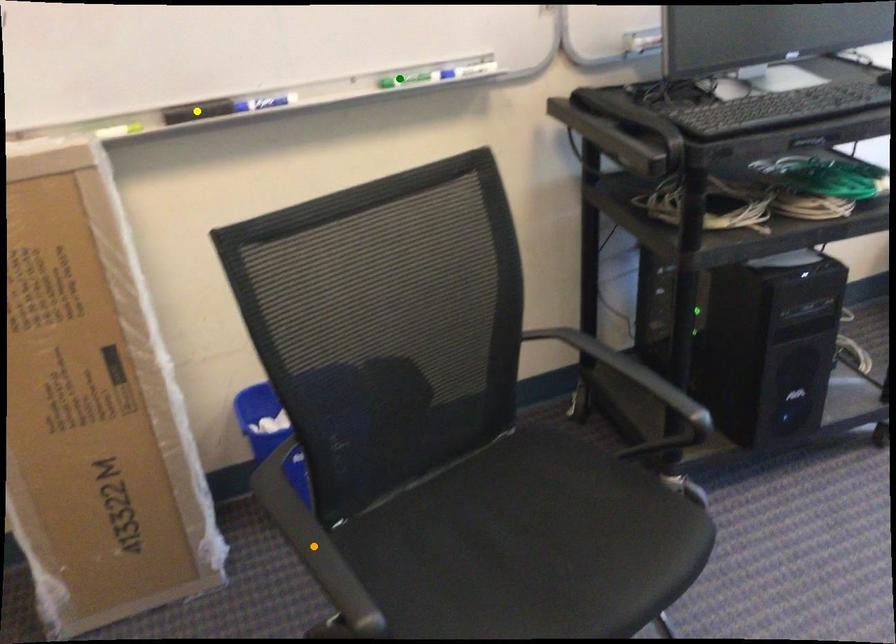
Order these from nearest to farthest:
- green point
- orange point
- yellow point

1. orange point
2. yellow point
3. green point